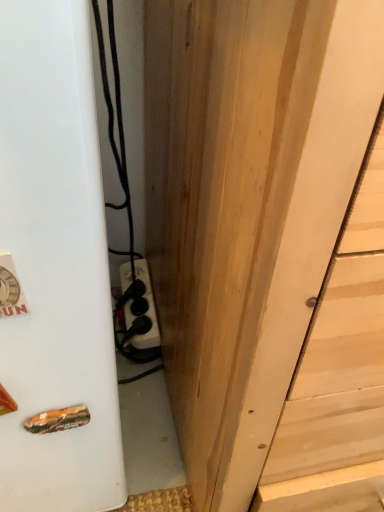
This screenshot has height=512, width=384. Describe the element at coordinates (55, 265) in the screenshot. I see `white matte refrigerator at left` at that location.

You are a GUI agent. You are given a task and a screenshot of the screen. Output one action in this format:
    pyautogui.click(x=<x>, y=<y>)
    Task: Click on the white matte refrigerator at left
    
    Given the screenshot: What is the action you would take?
    pyautogui.click(x=55, y=265)

This screenshot has width=384, height=512. What do you see at coordinates (247, 205) in the screenshot?
I see `natural wood door at center` at bounding box center [247, 205].

Where is `natural wood door at center`? The image size is (384, 512). natural wood door at center is located at coordinates (x=247, y=205).

Locate an element on the screen. Image resolution: width=384 pixels, height=512 pixels. white matte refrigerator at left is located at coordinates (55, 265).

Considering the positions of objects natural wood door at center and white matte refrigerator at left in the image provided, who is more to the left, natural wood door at center or white matte refrigerator at left?

From the viewer's perspective, white matte refrigerator at left appears more on the left side.

Relative to white matte refrigerator at left, is natural wood door at center in front or behind?

In the image, natural wood door at center appears in front of white matte refrigerator at left.

Which is less distant, (181, 263) or (85, 287)?

Point (181, 263) appears to be farther away from the viewer than point (85, 287).

From the image's perspective, is natural wood door at center located beneath white matte refrigerator at left?

Incorrect, from the image's perspective, natural wood door at center is higher than white matte refrigerator at left.

From a real-world perspective, is natural wood door at center over white matte refrigerator at left?

Yes, from a real-world perspective, natural wood door at center is on top of white matte refrigerator at left.

Is natural wood door at center wider than white matte refrigerator at left?

Yes.

Considering the sizes of objects natural wood door at center and white matte refrigerator at left in the image provided, who is shorter, natural wood door at center or white matte refrigerator at left?

Standing shorter between the two is white matte refrigerator at left.

Who is bigger, natural wood door at center or white matte refrigerator at left?

natural wood door at center.

Is natural wood door at center completely or partially outside of white matte refrigerator at left?

natural wood door at center lies outside white matte refrigerator at left's area.

Is natural wood door at center next to white matte refrigerator at left and touching it?

They are not placed beside each other.

Could you tell me if natural wood door at center is facing white matte refrigerator at left?

No, natural wood door at center does not turn towards white matte refrigerator at left.

Looking at this image, how far apart are natural wood door at center and white matte refrigerator at left?

A distance of 6.00 inches exists between natural wood door at center and white matte refrigerator at left.

Where is `door above the white matte refrigerator at left (from the image's perspective)`? Image resolution: width=384 pixels, height=512 pixels. door above the white matte refrigerator at left (from the image's perspective) is located at coordinates (247, 205).

Visually, is white matte refrigerator at left positioned to the left or to the right of natural wood door at center?

In the image, white matte refrigerator at left appears on the left side of natural wood door at center.

Is the depth of white matte refrigerator at left greater than that of natural wood door at center?

Yes, it is.

Consider the image. Which is closer, (60, 40) or (279, 362)?

Point (60, 40) appears to be closer to the viewer than point (279, 362).

From the image's perspective, which is below, white matte refrigerator at left or natural wood door at center?

white matte refrigerator at left is shown below in the image.

From the picture: From a real-world perspective, is white matte refrigerator at left positioned above or below natural wood door at center?

From a real-world perspective, white matte refrigerator at left is physically below natural wood door at center.

Can you confirm if white matte refrigerator at left is thinner than natural wood door at center?

Yes, white matte refrigerator at left is thinner than natural wood door at center.

Which of these two, white matte refrigerator at left or natural wood door at center, stands taller?

natural wood door at center.

Looking at this image, which of these two, white matte refrigerator at left or natural wood door at center, is smaller?

With smaller size is white matte refrigerator at left.

Is white matte refrigerator at left inside the boundaries of natural wood door at center, or outside?

white matte refrigerator at left is outside natural wood door at center.

Can you see white matte refrigerator at left touching natural wood door at center?

No, white matte refrigerator at left is not making contact with natural wood door at center.

Is white matte refrigerator at left aimed at natural wood door at center?

No, white matte refrigerator at left is not aimed at natural wood door at center.

Locate an element on the screen. The image size is (384, 512). appliance below the natural wood door at center (from the image's perspective) is located at coordinates (55, 265).

Locate an element on the screen. door on the right of white matte refrigerator at left is located at coordinates (x=247, y=205).

Locate an element on the screen. The image size is (384, 512). appliance that is below the natural wood door at center (from the image's perspective) is located at coordinates (55, 265).